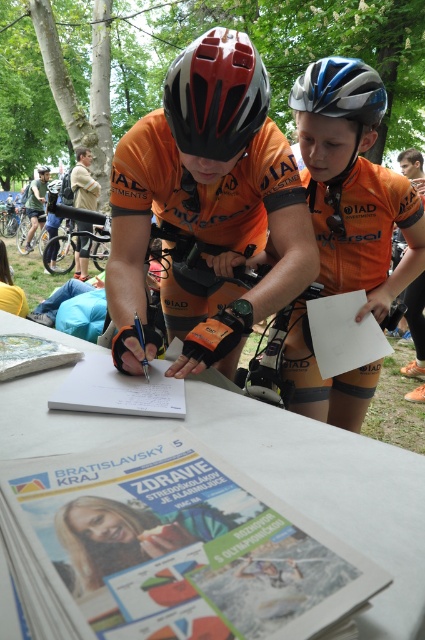
Based on the photo, you are standing at the starting line of a cycling event and see two points marked on the ground. The first point is at coordinate point (374,120) and the second point is at coordinate point (84,200). Which point is closer to you?

Point (374,120) is in front of point (84,200), so the first point is closer to you.